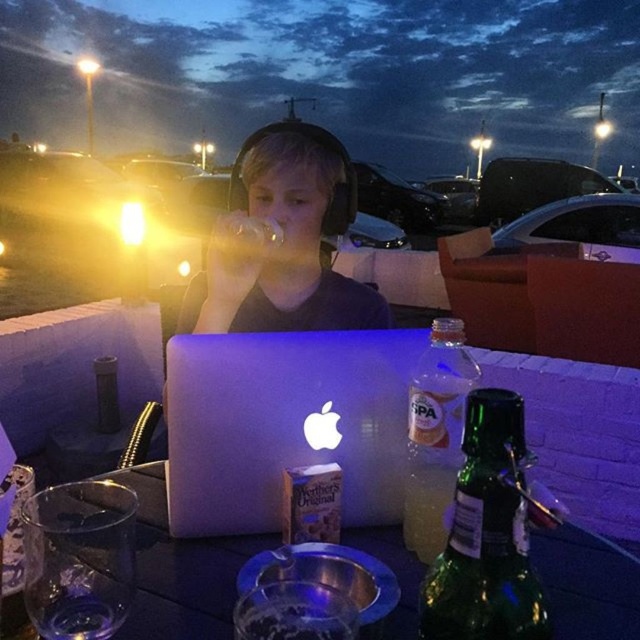
Is white plastic laptop at center taller than clear plastic bottle at right?

No, white plastic laptop at center is not taller than clear plastic bottle at right.

The height and width of the screenshot is (640, 640). I want to click on white plastic laptop at center, so click(284, 422).

Between shiny black table at center and green glass bottle at lower right, which one appears on the right side from the viewer's perspective?

From the viewer's perspective, green glass bottle at lower right appears more on the right side.

Measure the distance between shiny black table at center and camera.

They are 22.19 inches apart.

Locate an element on the screen. shiny black table at center is located at coordinates (180, 570).

Can you confirm if white plastic laptop at center is wider than green glass bottle at lower right?

Indeed, white plastic laptop at center has a greater width compared to green glass bottle at lower right.

Is white plastic laptop at center bigger than green glass bottle at lower right?

Yes, white plastic laptop at center is bigger than green glass bottle at lower right.

The height and width of the screenshot is (640, 640). I want to click on white plastic laptop at center, so click(284, 422).